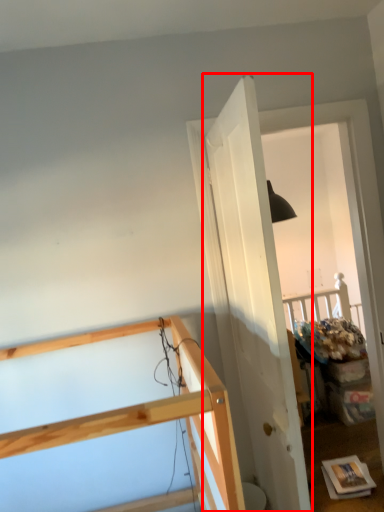
Question: In this image, where is door (annotated by the red box) located relative to furniture?

Choices:
 (A) right
 (B) left

Answer: (A)